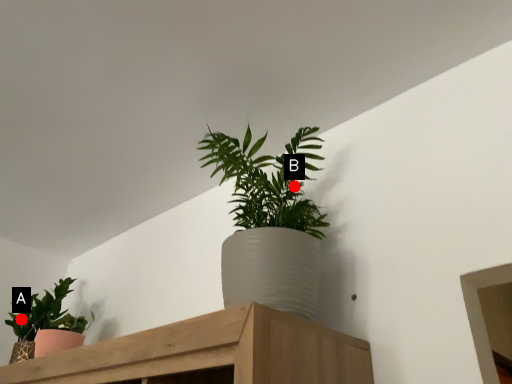
Question: Two points are circled on the image, labeled by A and B beside each circle. Which point is closer to the camera?

Choices:
 (A) A is closer
 (B) B is closer

Answer: (B)